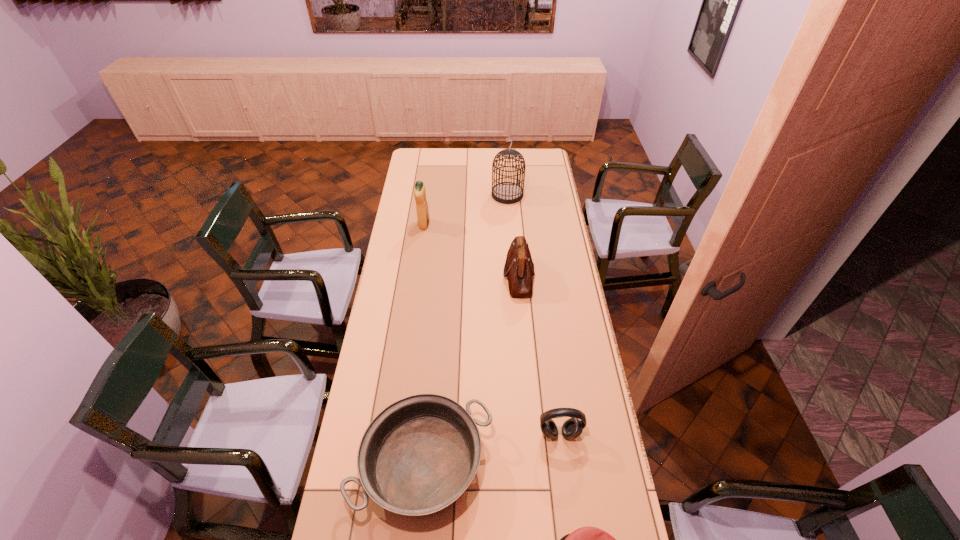
Where is `the tallest object`? The width and height of the screenshot is (960, 540). the tallest object is located at coordinates (506, 192).

You are a GUI agent. You are given a task and a screenshot of the screen. Output one action in this format:
    pyautogui.click(x=<x>, y=<y>)
    Task: Click on the birdcage
    This screenshot has height=540, width=960.
    Given the screenshot: What is the action you would take?
    pyautogui.click(x=506, y=192)

Identify the location of the fifth nearest object. The image size is (960, 540). (419, 190).

You are a GUI agent. You are given a task and a screenshot of the screen. Output one action in this format:
    pyautogui.click(x=<x>, y=<y>)
    Task: Click on the detergent
    
    Given the screenshot: What is the action you would take?
    pyautogui.click(x=419, y=190)

Locate an element on the screen. The height and width of the screenshot is (540, 960). the third tallest object is located at coordinates (519, 268).

Locate an element on the screen. This screenshot has width=960, height=540. the third farthest object is located at coordinates (519, 268).

The image size is (960, 540). Identify the location of headset. (572, 428).

Locate an element on the screen. The width and height of the screenshot is (960, 540). pan is located at coordinates (418, 455).

You are a GUI agent. You are given a task and a screenshot of the screen. Output one action in this format:
    pyautogui.click(x=<x>, y=<y>)
    Task: Click on the free space located 0.080m on the left of the tallest object
    
    Given the screenshot: What is the action you would take?
    pyautogui.click(x=476, y=195)

In order to click on free region located on the label of the fifth shortest object in this screenshot , I will do `click(452, 225)`.